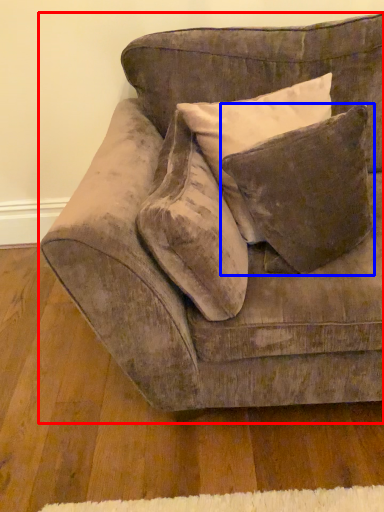
Question: Which point is further to the camera, studio couch (highlighted by a red box) or pillow (highlighted by a blue box)?

Choices:
 (A) studio couch
 (B) pillow

Answer: (B)